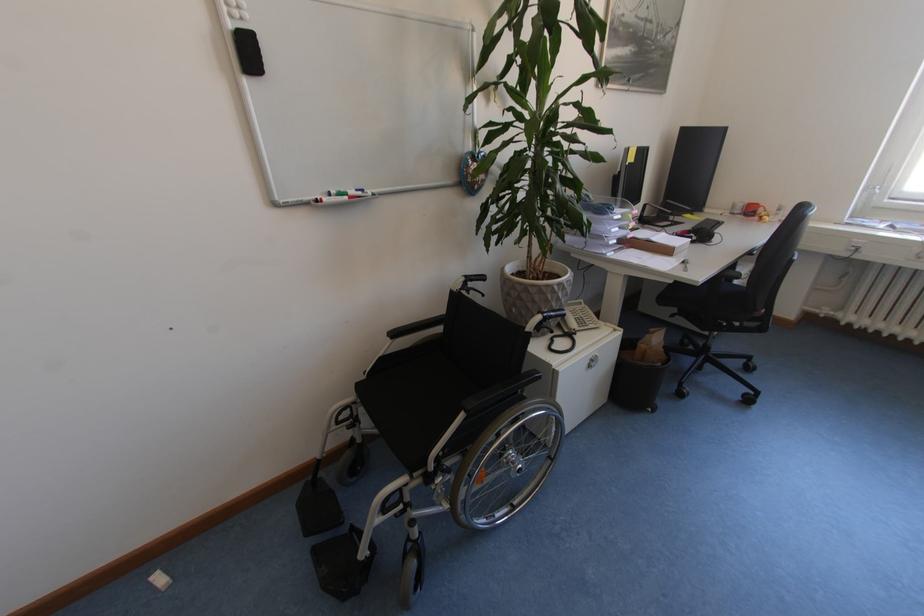
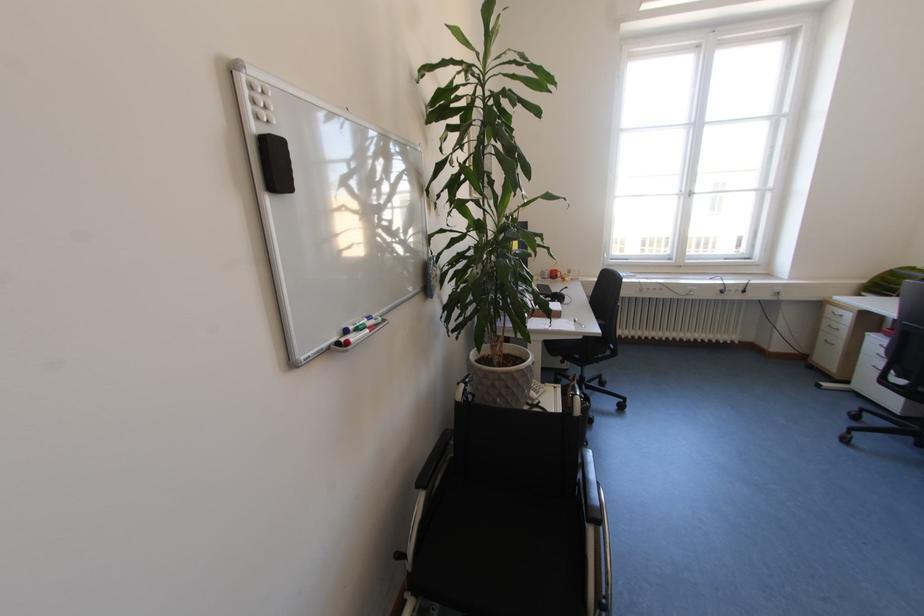
Where in the second image is the point corresponding to [596,326] from the first image?

(546, 392)